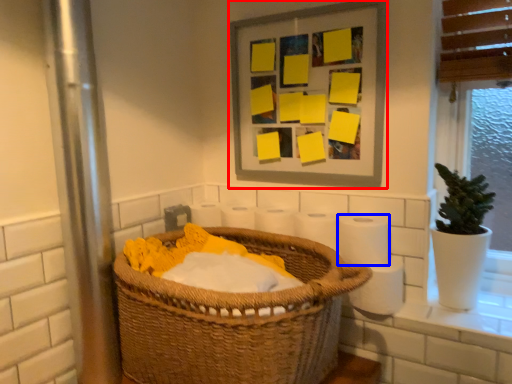
Question: Which object appears closest to the camera in this image, picture frame (highlighted by a red box) or toilet paper (highlighted by a blue box)?

Choices:
 (A) picture frame
 (B) toilet paper

Answer: (B)